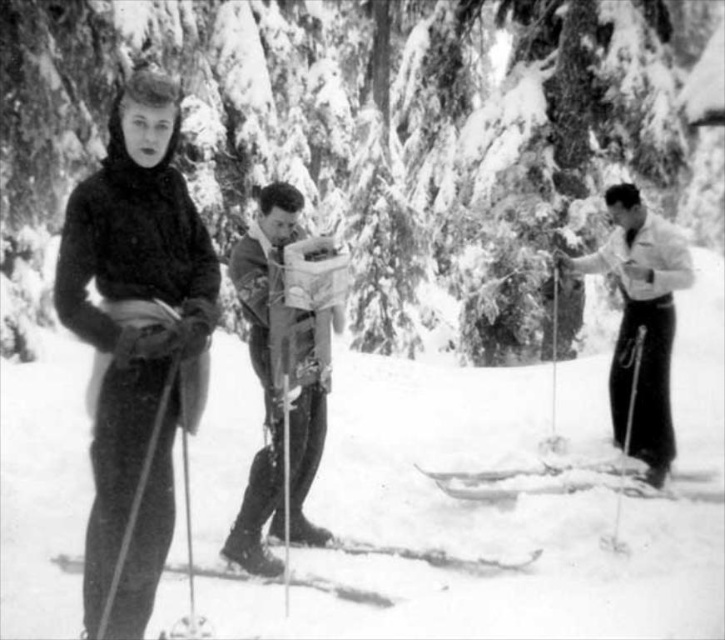
You are a photographer trying to capture a closeup of the smooth wood skis at center and the metallic ski pole at left. Since you want both objects to appear the same size in the photo, which object should you move closer to the camera?

To make both objects appear the same size in the photo, you should move the metallic ski pole at left closer to the camera because the smooth wood skis at center is larger in size and requires less proximity to match the apparent size of the smaller metallic ski pole at left.

Looking at this image, you are planning to place a 2.5 meters long wooden bench between the smooth snow at center and the metallic silver ski pole at center. Will the bench fit in the space between them?

The smooth snow at center is 2.21 meters from the metallic silver ski pole at center. Since the bench is 2.5 meters long, it is longer than the available space of 2.21 meters, so the bench will not fit between them.

You are a photographer positioned at the origin point of the coordinate system. You want to take a photo of the metallic silver ski at center. What are the coordinates where you should aim your camera?

The coordinates to aim your camera are at point (x=418, y=554) to capture the metallic silver ski at center.